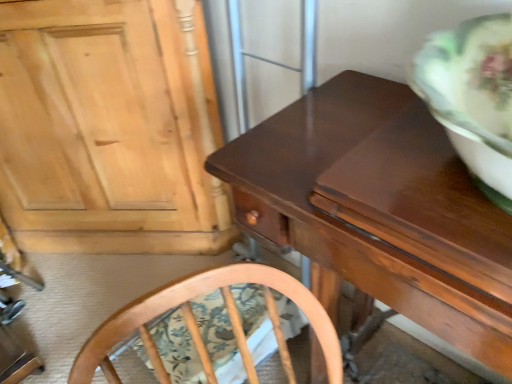
Question: From the image's perspective, is light wood cabinet at upper left above shiny brown wood table at center?

Choices:
 (A) yes
 (B) no

Answer: (A)

Question: Can you confirm if light wood cabinet at upper left is positioned to the left of shiny brown wood table at center?

Choices:
 (A) yes
 (B) no

Answer: (A)

Question: Considering the relative positions of light wood cabinet at upper left and shiny brown wood table at center in the image provided, is light wood cabinet at upper left in front of shiny brown wood table at center?

Choices:
 (A) yes
 (B) no

Answer: (B)

Question: Would you consider light wood cabinet at upper left to be distant from shiny brown wood table at center?

Choices:
 (A) no
 (B) yes

Answer: (A)

Question: Is light wood cabinet at upper left taller than shiny brown wood table at center?

Choices:
 (A) yes
 (B) no

Answer: (A)

Question: Can you confirm if light wood cabinet at upper left is shorter than shiny brown wood table at center?

Choices:
 (A) yes
 (B) no

Answer: (B)

Question: Does shiny brown wood table at center come behind light wood cabinet at upper left?

Choices:
 (A) yes
 (B) no

Answer: (B)

Question: Does shiny brown wood table at center appear on the left side of light wood cabinet at upper left?

Choices:
 (A) yes
 (B) no

Answer: (B)

Question: Is shiny brown wood table at center positioned in front of light wood cabinet at upper left?

Choices:
 (A) no
 (B) yes

Answer: (B)

Question: Is shiny brown wood table at center surrounding light wood cabinet at upper left?

Choices:
 (A) no
 (B) yes

Answer: (A)

Question: Can you confirm if shiny brown wood table at center is thinner than light wood cabinet at upper left?

Choices:
 (A) no
 (B) yes

Answer: (A)

Question: Considering the relative sizes of shiny brown wood table at center and light wood cabinet at upper left in the image provided, is shiny brown wood table at center bigger than light wood cabinet at upper left?

Choices:
 (A) yes
 (B) no

Answer: (B)

Question: Is shiny brown wood table at center in front of or behind light wood cabinet at upper left in the image?

Choices:
 (A) behind
 (B) front

Answer: (B)